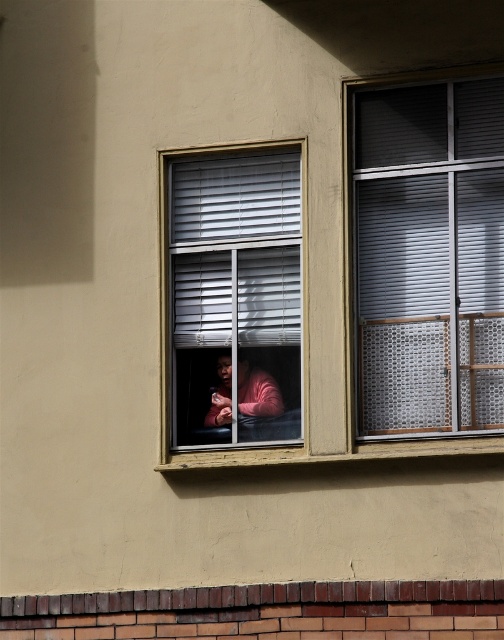
Does metallic silver blinds at upper right have a greater height compared to matte plastic window at center?

Indeed, metallic silver blinds at upper right has a greater height compared to matte plastic window at center.

Is point (423, 301) farther from viewer compared to point (248, 416)?

That is False.

Where is `metallic silver blinds at upper right`? metallic silver blinds at upper right is located at coordinates pyautogui.click(x=429, y=257).

Between matte plastic window at center and pink matte sweater at center, which one has less height?

Standing shorter between the two is pink matte sweater at center.

Is point (241, 444) more distant than point (280, 404)?

No, (241, 444) is closer to viewer.

What do you see at coordinates (232, 296) in the screenshot? The height and width of the screenshot is (640, 504). I see `matte plastic window at center` at bounding box center [232, 296].

The image size is (504, 640). I want to click on matte plastic window at center, so click(x=232, y=296).

Does metallic silver blinds at upper right have a lesser width compared to pink matte sweater at center?

No.

Can you confirm if metallic silver blinds at upper right is positioned above pink matte sweater at center?

Indeed, metallic silver blinds at upper right is positioned over pink matte sweater at center.

Image resolution: width=504 pixels, height=640 pixels. What are the coordinates of `metallic silver blinds at upper right` in the screenshot? It's located at (429, 257).